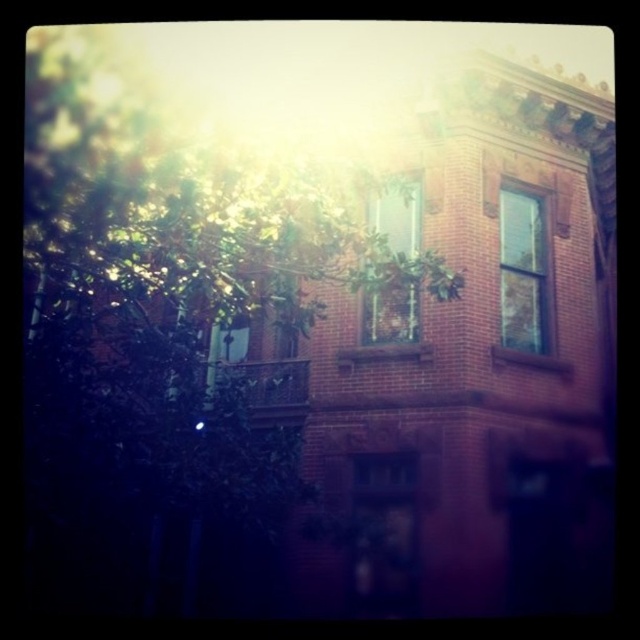
Question: From the image, what is the correct spatial relationship of green leafy tree at upper left in relation to clear glass window at center?

Choices:
 (A) below
 (B) above

Answer: (A)

Question: Can you confirm if green leafy tree at upper left is wider than clear glass window at center?

Choices:
 (A) no
 (B) yes

Answer: (B)

Question: Which of these objects is positioned closest to the green leafy tree at upper left?

Choices:
 (A) clear glass window at upper right
 (B) clear glass window at center

Answer: (B)

Question: Which object is the farthest from the clear glass window at center?

Choices:
 (A) green leafy tree at upper left
 (B) clear glass window at upper right

Answer: (A)

Question: Which point is farther to the camera?

Choices:
 (A) clear glass window at center
 (B) clear glass window at upper right

Answer: (A)

Question: Does green leafy tree at upper left appear on the left side of clear glass window at upper right?

Choices:
 (A) no
 (B) yes

Answer: (B)